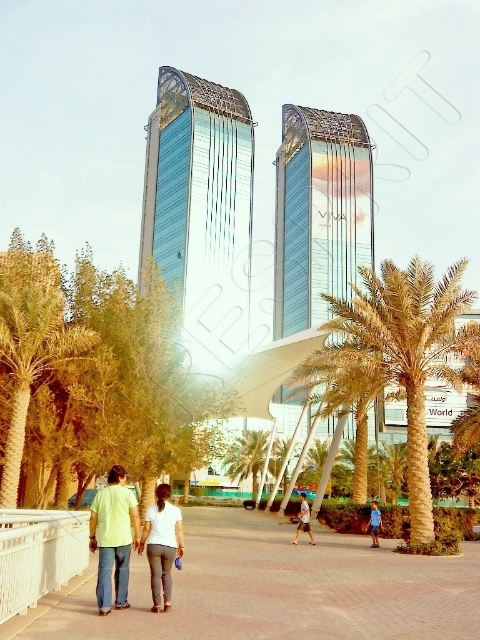
Does green leafy palm tree at left have a lesser width compared to green leafy palm tree at center?

Incorrect, green leafy palm tree at left's width is not less than green leafy palm tree at center's.

Can you confirm if green leafy palm tree at left is positioned above green leafy palm tree at center?

Yes.

This screenshot has height=640, width=480. I want to click on green leafy palm tree at left, so click(x=32, y=360).

Identify the location of green leafy palm tree at left. (32, 360).

How much distance is there between light yellow shirt at center and green leafy palm tree at center?

light yellow shirt at center is 109.55 feet from green leafy palm tree at center.

Which is above, light yellow shirt at center or green leafy palm tree at center?

Positioned higher is light yellow shirt at center.

Image resolution: width=480 pixels, height=640 pixels. Identify the location of light yellow shirt at center. (113, 538).

Can you confirm if paved brick sidewalk at center is positioned to the left of light brown leather jacket at center?

Correct, you'll find paved brick sidewalk at center to the left of light brown leather jacket at center.

Is point (227, 508) more distant than point (299, 520)?

Yes, point (227, 508) is farther from viewer.

Identify the location of paved brick sidewalk at center. tap(282, 589).

Find the location of a particular element. The height and width of the screenshot is (640, 480). paved brick sidewalk at center is located at coordinates (282, 589).